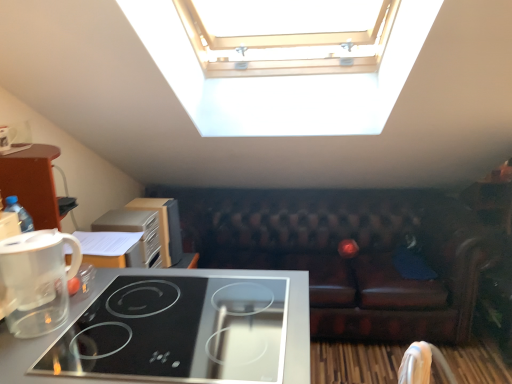
Question: Considering the positions of black glass cooktop at lower left and white fabric armchair at lower right in the image, is black glass cooktop at lower left taller or shorter than white fabric armchair at lower right?

Choices:
 (A) short
 (B) tall

Answer: (B)

Question: From a real-world perspective, is black glass cooktop at lower left physically located above or below white fabric armchair at lower right?

Choices:
 (A) above
 (B) below

Answer: (A)

Question: Which object is positioned closest to the satin silver toaster at upper left, which is the first appliance in front-to-back order?

Choices:
 (A) wooden cabinet at left, the 2th appliance positioned from the front
 (B) white fabric armchair at lower right
 (C) transparent plastic coffee maker at lower left
 (D) brown leather couch at center
 (E) black glass cooktop at lower left

Answer: (A)

Question: Considering the real-world distances, which object is farthest from the satin silver toaster at upper left, which is the first appliance in front-to-back order?

Choices:
 (A) transparent plastic coffee maker at lower left
 (B) wooden cabinet at left, marked as the first appliance in a back-to-front arrangement
 (C) black glass cooktop at lower left
 (D) brown leather couch at center
 (E) white fabric armchair at lower right

Answer: (E)